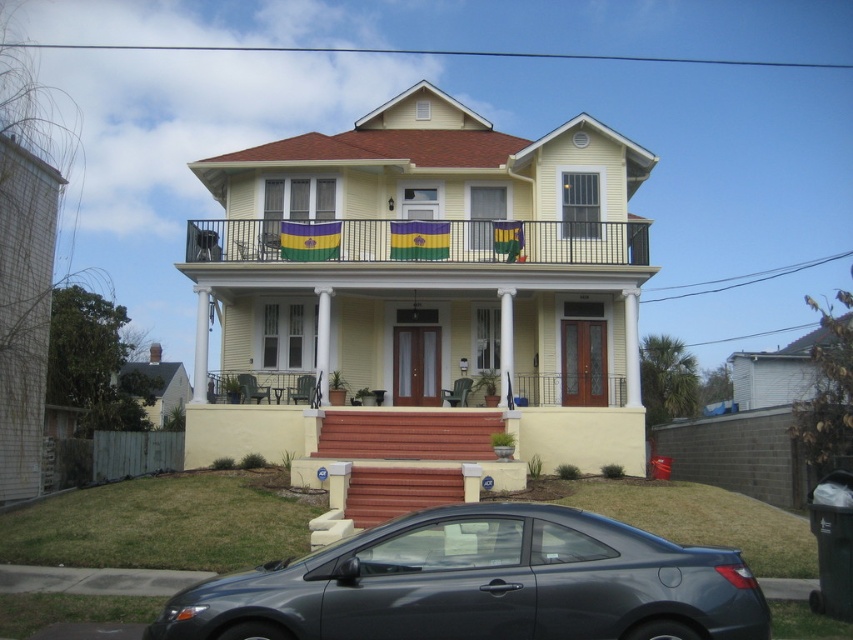
Question: Can you confirm if satin black car at lower center is bigger than metallic wrought iron balcony at upper center?

Choices:
 (A) no
 (B) yes

Answer: (A)

Question: Is satin black car at lower center closer to the viewer compared to metallic wrought iron balcony at upper center?

Choices:
 (A) no
 (B) yes

Answer: (B)

Question: Which point is closer to the camera taking this photo?

Choices:
 (A) (285, 260)
 (B) (451, 582)

Answer: (B)

Question: Which of the following is the closest to the observer?

Choices:
 (A) metallic wrought iron balcony at upper center
 (B) satin black car at lower center

Answer: (B)

Question: Which point is farther to the camera?

Choices:
 (A) (621, 564)
 (B) (602, 253)

Answer: (B)

Question: Does satin black car at lower center have a larger size compared to metallic wrought iron balcony at upper center?

Choices:
 (A) no
 (B) yes

Answer: (A)